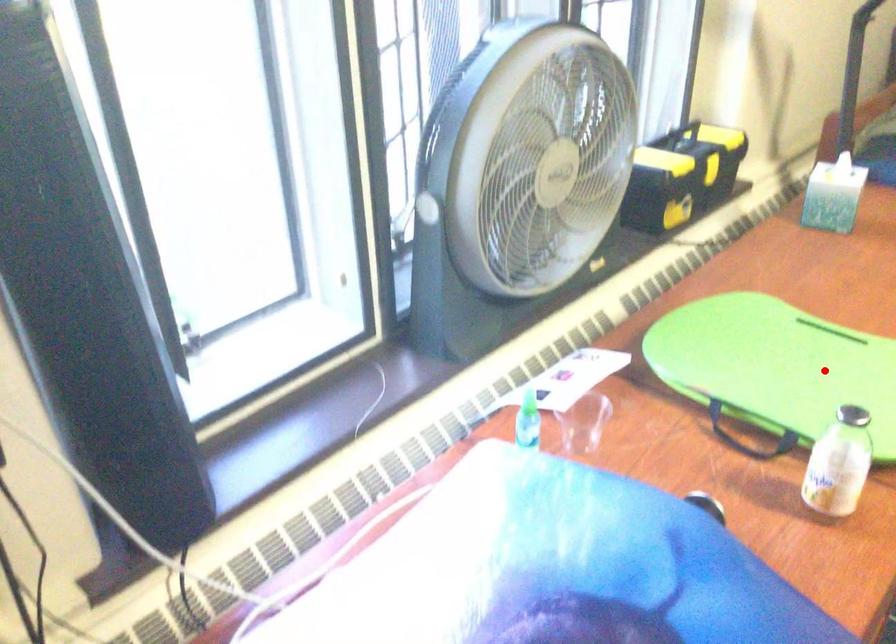
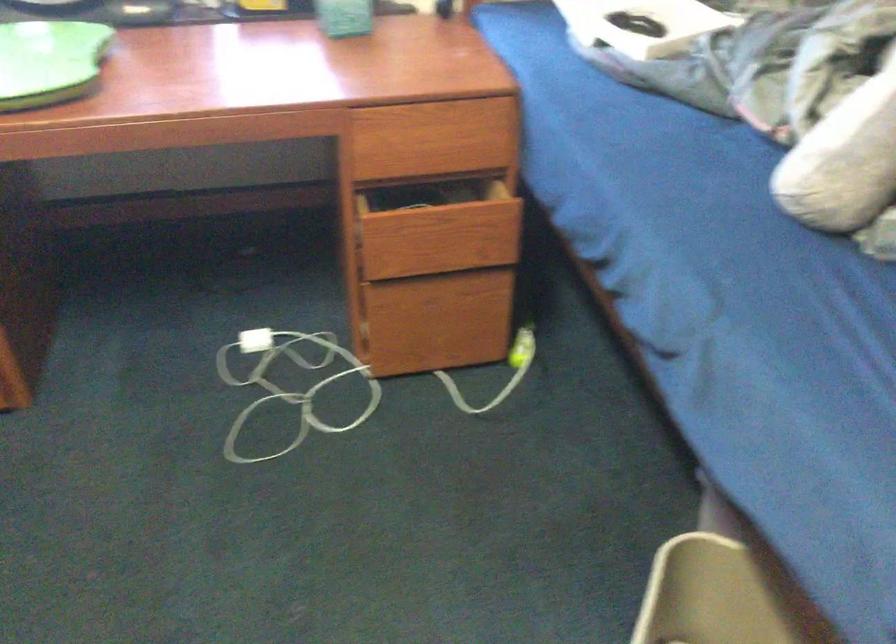
Question: I am providing you with two images of the same scene from different viewpoints. In image1, a red point is highlighted. Considering the same 3D point in image2, which of the following is correct?

Choices:
 (A) It is closer
 (B) It is farther

Answer: (B)